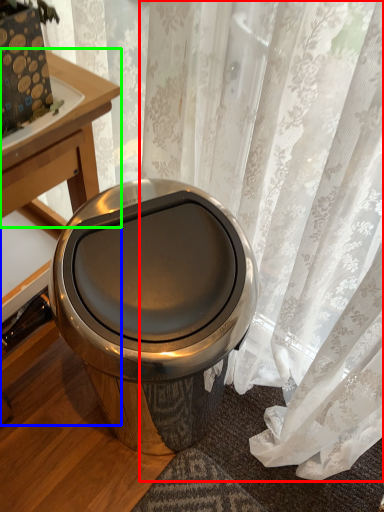
Question: Which object is the farthest from curtain (highlighted by a red box)? Choose among these: table (highlighted by a blue box) or round table (highlighted by a green box).

Choices:
 (A) table
 (B) round table

Answer: (A)